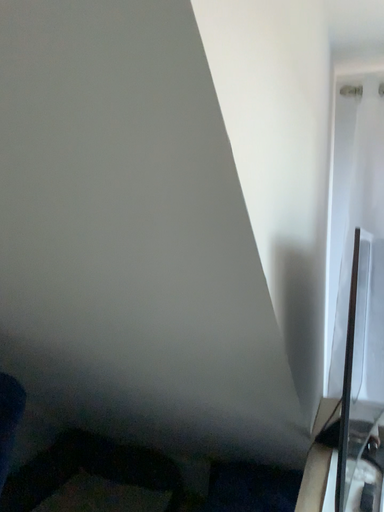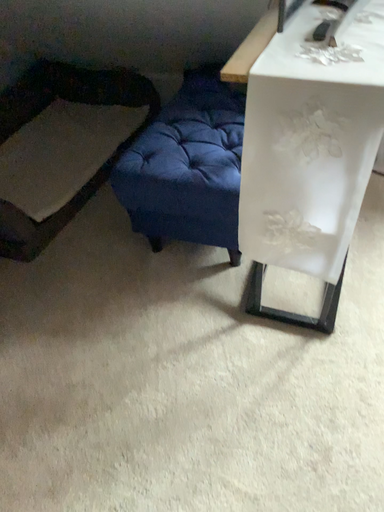
Question: Which way did the camera rotate in the video?

Choices:
 (A) rotated downward
 (B) rotated upward

Answer: (A)